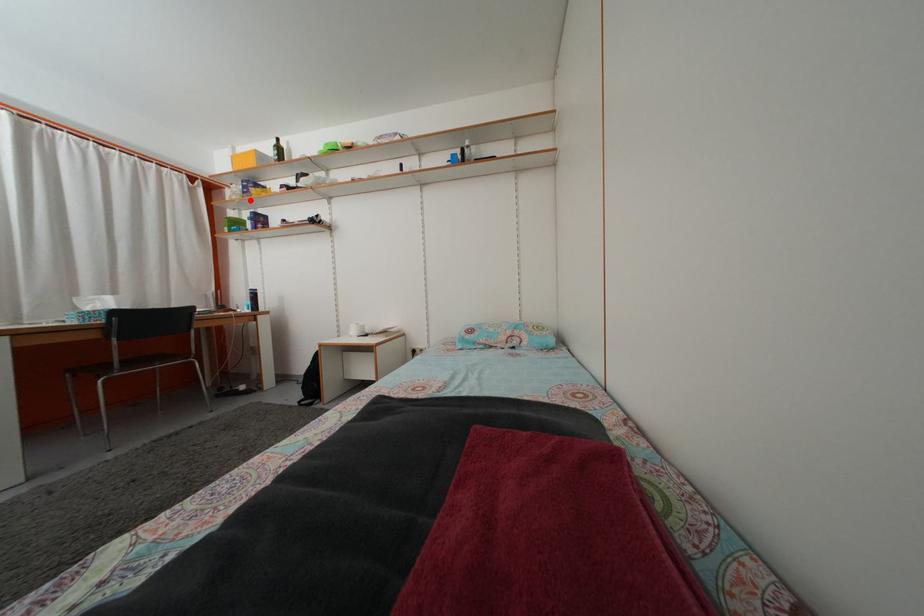
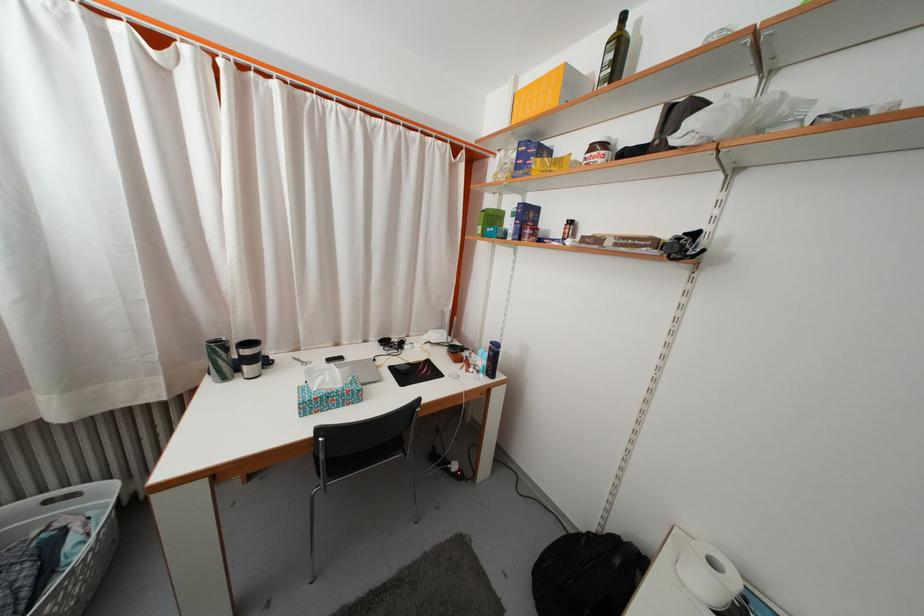
In the second image, find the point that corresponds to the highlighted location in the first image.

(523, 175)